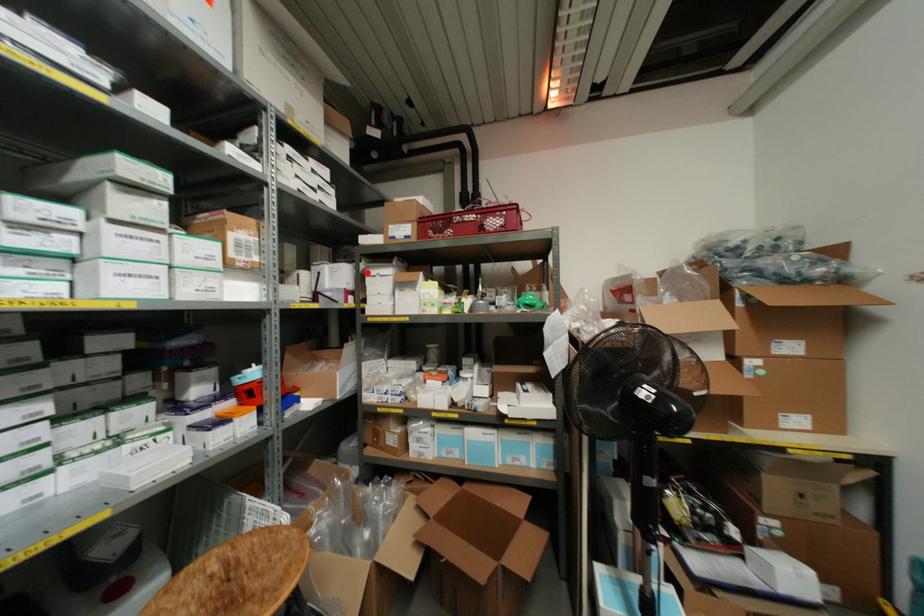
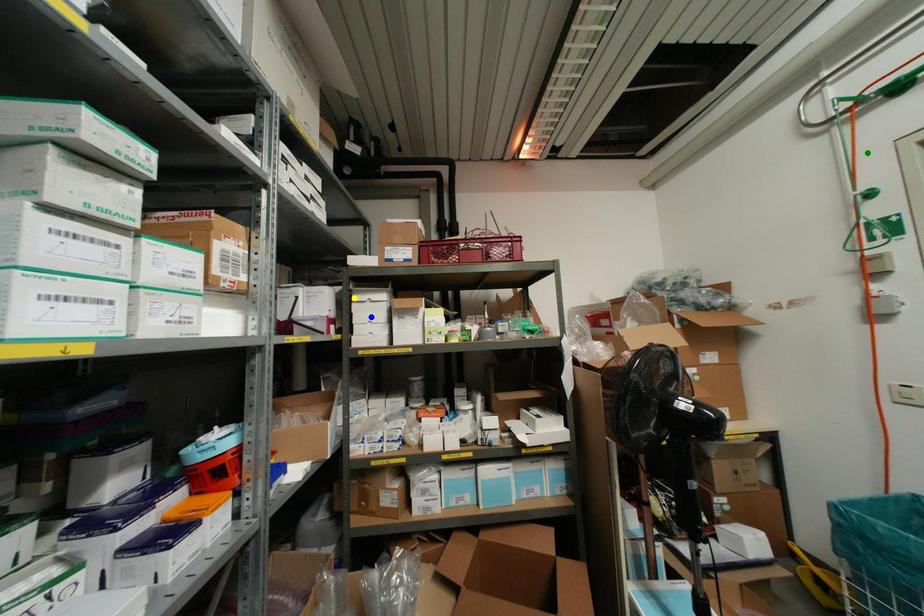
Question: I am providing you with two images of the same scene from different viewpoints. A red point is marked on the first image. You are given multiple points on the second image. Which mark in image 2 goes with the point in image 1?

Choices:
 (A) yellow point
 (B) blue point
 (C) green point

Answer: (A)